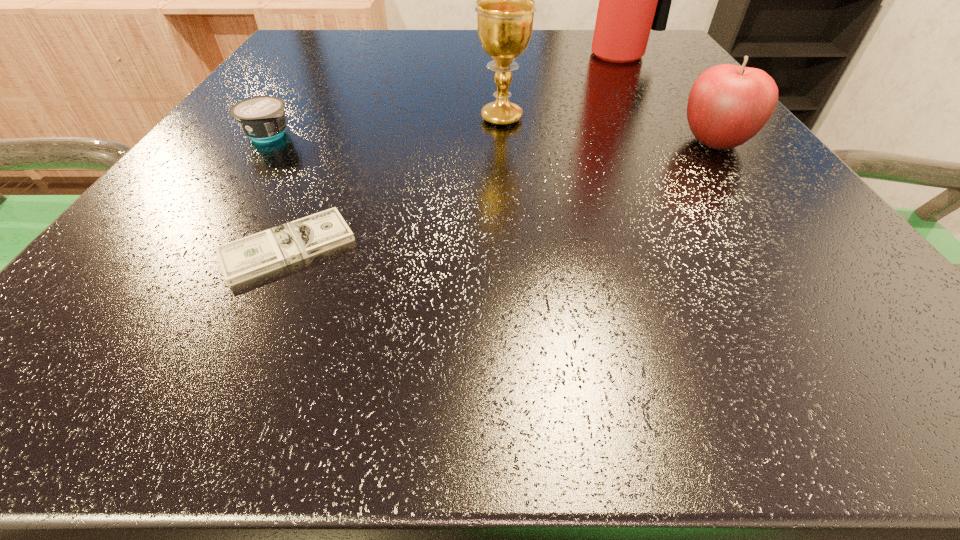
At what (x,y) coordinates should I click in order to perform the action: click on vacant space at the near edge of the desktop. Please return your answer as a coordinate pair (x, y). The width and height of the screenshot is (960, 540). Looking at the image, I should click on (299, 327).

Find the location of a particular element. The image size is (960, 540). vacant area at the left edge is located at coordinates (318, 104).

Find the location of a particular element. This screenshot has height=540, width=960. vacant space at the right edge is located at coordinates (830, 255).

Identify the location of free space at the far left corner of the desktop. (330, 60).

What are the coordinates of `vacant space that's between the nearest object and the yogurt` in the screenshot? It's located at (278, 191).

Identify the location of free spot between the fourth tallest object and the apple. Image resolution: width=960 pixels, height=540 pixels. (492, 138).

Locate an element on the screen. empty space between the nearest object and the fourth tallest object is located at coordinates (278, 191).

Locate an element on the screen. This screenshot has height=540, width=960. vacant area that lies between the tallest object and the yogurt is located at coordinates (444, 94).

In order to click on vacant space in between the shortest object and the third tallest object in this screenshot , I will do `click(501, 194)`.

Identify the location of empty space between the chalice and the yogurt. (386, 126).